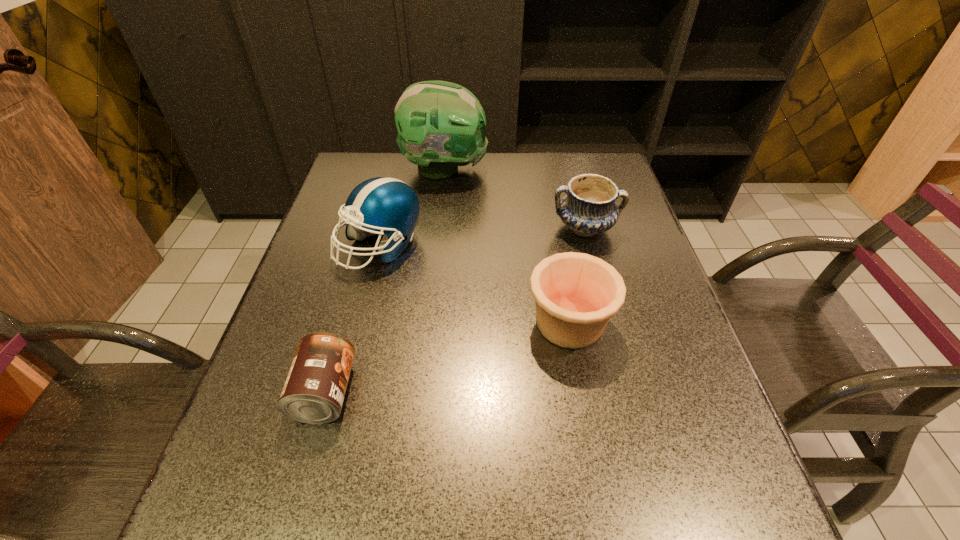
Identify the location of free space located 0.160m on the left of the farther pottery. click(492, 228).

At what (x,y) coordinates should I click in order to perform the action: click on vacant region located 0.140m on the left of the second nearest object. Please return your answer as a coordinate pair (x, y). This screenshot has width=960, height=540. Looking at the image, I should click on (463, 322).

At what (x,y) coordinates should I click in order to perform the action: click on vacant space situated 0.240m on the front label of the nearest object. Please return your answer as a coordinate pair (x, y). The height and width of the screenshot is (540, 960). Looking at the image, I should click on (478, 393).

At what (x,y) coordinates should I click in order to perform the action: click on object that is at the far edge. Please return your answer as a coordinate pair (x, y). Image resolution: width=960 pixels, height=540 pixels. Looking at the image, I should click on (441, 125).

This screenshot has height=540, width=960. Identify the location of football helmet located in the left edge section of the desktop. (390, 206).

The image size is (960, 540). I want to click on can that is at the left edge, so click(315, 387).

In order to click on free space at the far edge of the desktop in this screenshot , I will do `click(502, 157)`.

At what (x,y) coordinates should I click in order to perform the action: click on vacant region at the near edge of the desktop. Please return your answer as a coordinate pair (x, y). The image size is (960, 540). Looking at the image, I should click on (388, 497).

At what (x,y) coordinates should I click in order to perform the action: click on vacant area at the left edge. Please return your answer as a coordinate pair (x, y). Image resolution: width=960 pixels, height=540 pixels. Looking at the image, I should click on (304, 283).

Where is `unoccupied position between the fourth farthest object and the farther football helmet`? This screenshot has height=540, width=960. unoccupied position between the fourth farthest object and the farther football helmet is located at coordinates (507, 246).